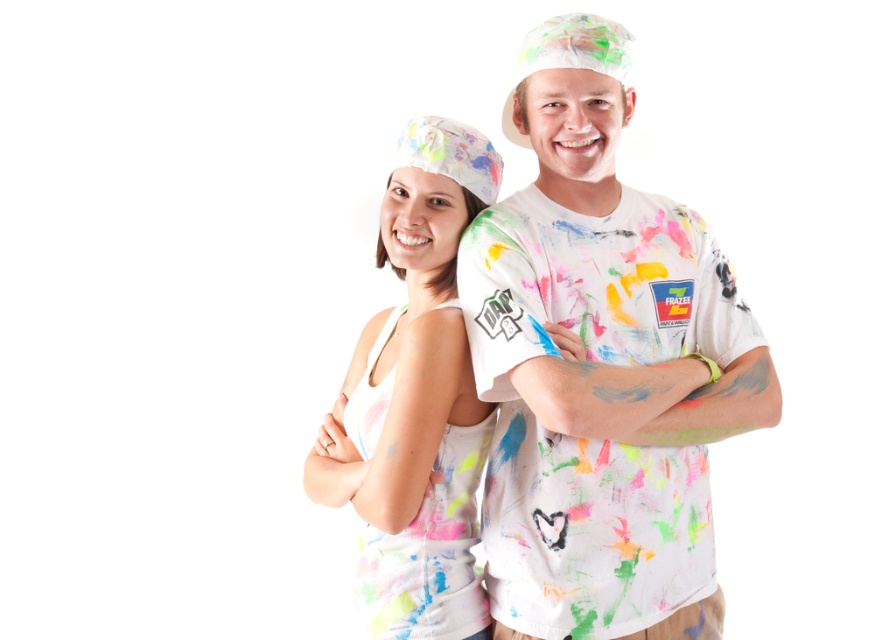
Question: Which point is farther to the camera?

Choices:
 (A) (386, 467)
 (B) (563, 156)

Answer: (B)

Question: Which point is closer to the camera?

Choices:
 (A) (563, 157)
 (B) (472, 477)

Answer: (A)

Question: Is paint-splattered t-shirt at center positioned at the back of matte white tank top at center?

Choices:
 (A) no
 (B) yes

Answer: (A)

Question: Is paint-splattered t-shirt at center smaller than matte white tank top at center?

Choices:
 (A) yes
 (B) no

Answer: (B)

Question: In this image, where is paint-splattered t-shirt at center located relative to matte white tank top at center?

Choices:
 (A) left
 (B) right

Answer: (B)